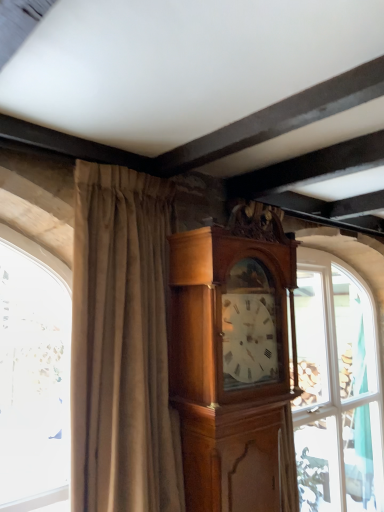
Question: Is beige velvet curtain at center located within clear glass window at center?

Choices:
 (A) no
 (B) yes

Answer: (A)

Question: From a real-world perspective, is clear glass window at center physically above beige velvet curtain at center?

Choices:
 (A) yes
 (B) no

Answer: (B)

Question: Is clear glass window at center not within beige velvet curtain at center?

Choices:
 (A) yes
 (B) no

Answer: (A)

Question: Is clear glass window at center wider than beige velvet curtain at center?

Choices:
 (A) yes
 (B) no

Answer: (A)

Question: From the image's perspective, is clear glass window at center on top of beige velvet curtain at center?

Choices:
 (A) yes
 (B) no

Answer: (B)

Question: Choose the correct answer: Is clear glass window at center inside polished wood grandfather clock at center or outside it?

Choices:
 (A) inside
 (B) outside

Answer: (B)

Question: From a real-world perspective, relative to polished wood grandfather clock at center, is clear glass window at center vertically above or below?

Choices:
 (A) below
 (B) above

Answer: (A)

Question: Relative to polished wood grandfather clock at center, is clear glass window at center in front or behind?

Choices:
 (A) behind
 (B) front

Answer: (A)

Question: Is point (347, 446) closer or farther from the camera than point (190, 473)?

Choices:
 (A) closer
 (B) farther

Answer: (B)

Question: In terms of width, does beige velvet curtain at center look wider or thinner when compared to polished wood grandfather clock at center?

Choices:
 (A) wide
 (B) thin

Answer: (A)

Question: Based on their positions, is beige velvet curtain at center located to the left or right of polished wood grandfather clock at center?

Choices:
 (A) right
 (B) left

Answer: (B)

Question: Considering the positions of beige velvet curtain at center and polished wood grandfather clock at center in the image, is beige velvet curtain at center taller or shorter than polished wood grandfather clock at center?

Choices:
 (A) short
 (B) tall

Answer: (B)

Question: Is beige velvet curtain at center situated inside polished wood grandfather clock at center or outside?

Choices:
 (A) outside
 (B) inside

Answer: (A)

Question: In terms of height, does polished wood grandfather clock at center look taller or shorter compared to clear glass window at center?

Choices:
 (A) short
 (B) tall

Answer: (A)

Question: Choose the correct answer: Is polished wood grandfather clock at center inside clear glass window at center or outside it?

Choices:
 (A) inside
 (B) outside

Answer: (B)